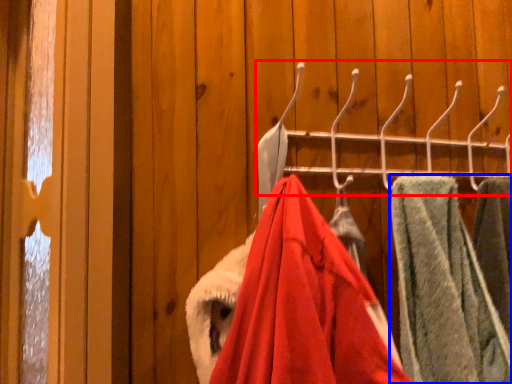
Question: Which object is closer to the camera taking this photo, closet (highlighted by a red box) or towel (highlighted by a blue box)?

Choices:
 (A) closet
 (B) towel

Answer: (B)